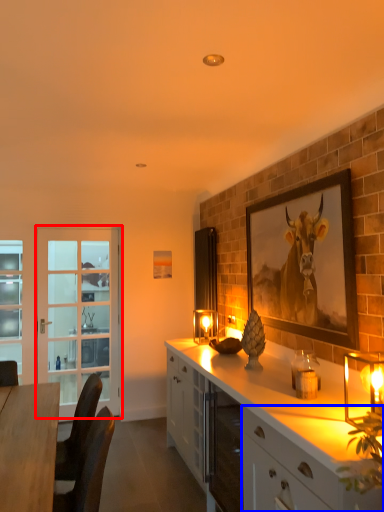
Question: Which object is further to the camera taking this photo, screen door (highlighted by a red box) or cabinetry (highlighted by a blue box)?

Choices:
 (A) screen door
 (B) cabinetry

Answer: (A)